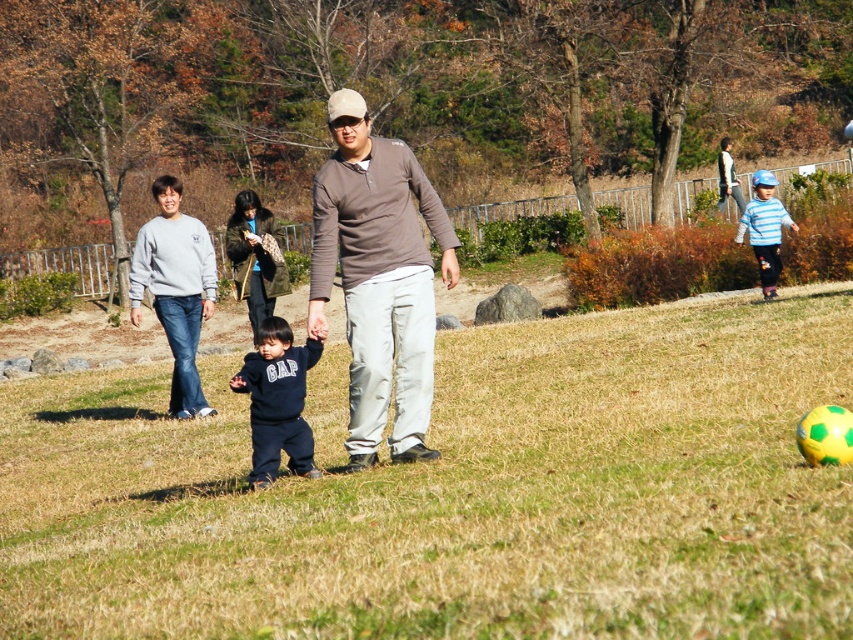
Does brown dry grass at center appear on the left side of gray sweatshirt at left?

In fact, brown dry grass at center is to the right of gray sweatshirt at left.

Consider the image. Can you confirm if brown dry grass at center is taller than gray sweatshirt at left?

No.

Where is `brown dry grass at center`? This screenshot has height=640, width=853. brown dry grass at center is located at coordinates (457, 493).

Is dark blue cotton sweater at center behind matte brown shirt at center?

No, it is in front of matte brown shirt at center.

Between dark blue cotton sweater at center and matte brown shirt at center, which one is positioned lower?

dark blue cotton sweater at center

Which is behind, point (374, 378) or point (351, 168)?

Positioned behind is point (351, 168).

Find the location of a particular element. Image resolution: width=853 pixels, height=640 pixels. dark blue cotton sweater at center is located at coordinates (378, 278).

Who is taller, dark blue cotton sweater at center or blue striped sweater at right?

Standing taller between the two is dark blue cotton sweater at center.

Identify the location of dark blue cotton sweater at center. (378, 278).

Identify the location of dark blue cotton sweater at center. (378, 278).